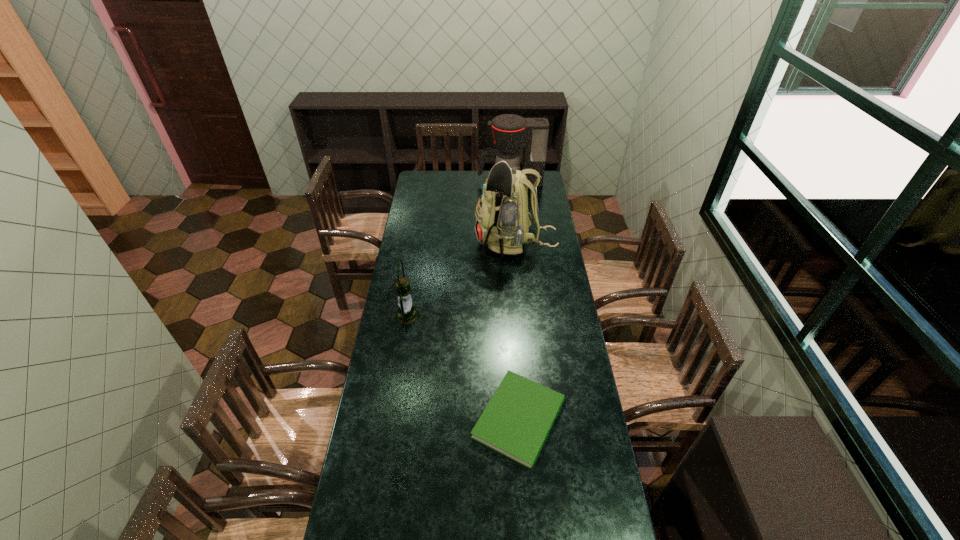
The height and width of the screenshot is (540, 960). I want to click on empty location between the backpack and the third farthest object, so click(462, 280).

At what (x,y) coordinates should I click in order to perform the action: click on blank region between the third tallest object and the farthest object. Please return your answer as a coordinate pair (x, y). Looking at the image, I should click on (459, 249).

Identify the location of vacant area that lies between the shortest object and the coffee maker. pyautogui.click(x=515, y=300).

This screenshot has width=960, height=540. I want to click on free space between the tallest object and the lantern, so click(462, 280).

You are a GUI agent. You are given a task and a screenshot of the screen. Output one action in this format:
    pyautogui.click(x=<x>, y=<y>)
    Task: Click on the free space that is in between the leftmost object and the third shortest object
    
    Given the screenshot: What is the action you would take?
    pyautogui.click(x=459, y=249)

Where is `unoccupied position between the tallest object and the second shortest object`? unoccupied position between the tallest object and the second shortest object is located at coordinates (462, 280).

Where is `object that can be found as the closest to the tallest object`? object that can be found as the closest to the tallest object is located at coordinates (510, 132).

Choose which object is the nearest neighbor to the farthest object. Please provide its 2D coordinates. Your answer should be formatted as a tuple, i.e. [(x, y)], where the tuple contains the x and y coordinates of a point satisfying the conditions above.

[(502, 222)]

Locate an element on the screen. Image resolution: width=960 pixels, height=540 pixels. vacant space that satisfies the following two spatial constraints: 1. on the back side of the shortest object; 2. on the side where the second shortest object emits light is located at coordinates (512, 316).

Find the location of `vacant point that satisfies the following two spatial constraints: 1. on the side where the third farthest object emits light; 2. on the back side of the nearest object`. vacant point that satisfies the following two spatial constraints: 1. on the side where the third farthest object emits light; 2. on the back side of the nearest object is located at coordinates (391, 419).